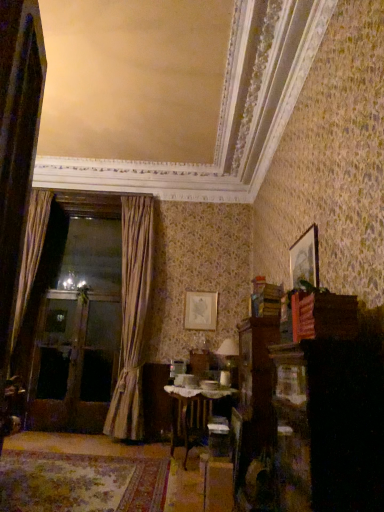
Question: Is wooden table at center wider than matte gold picture frame at center, marked as the second picture frame in a front-to-back arrangement?

Choices:
 (A) no
 (B) yes

Answer: (B)

Question: Considering the relative sizes of wooden table at center and matte gold picture frame at center, which ranks as the first picture frame in left-to-right order, in the image provided, is wooden table at center thinner than matte gold picture frame at center, which ranks as the first picture frame in left-to-right order,?

Choices:
 (A) no
 (B) yes

Answer: (A)

Question: Is wooden table at center turned away from matte gold picture frame at center, which is counted as the first picture frame, starting from the bottom?

Choices:
 (A) yes
 (B) no

Answer: (B)

Question: Is wooden table at center aimed at matte gold picture frame at center, which ranks as the first picture frame in left-to-right order?

Choices:
 (A) yes
 (B) no

Answer: (B)

Question: Would you say wooden table at center is outside matte gold picture frame at center, the 2th picture frame from the top?

Choices:
 (A) yes
 (B) no

Answer: (A)

Question: From the image's perspective, is silky beige curtain at left, marked as the 1th curtain in a left-to-right arrangement, positioned above or below gold textured curtain at left, the first curtain positioned from the right?

Choices:
 (A) below
 (B) above

Answer: (B)

Question: From a real-world perspective, relative to gold textured curtain at left, placed as the 2th curtain when sorted from left to right, is silky beige curtain at left, marked as the 1th curtain in a left-to-right arrangement, vertically above or below?

Choices:
 (A) below
 (B) above

Answer: (B)

Question: Considering the positions of point (39, 228) and point (125, 254), is point (39, 228) closer or farther from the camera than point (125, 254)?

Choices:
 (A) closer
 (B) farther

Answer: (B)

Question: Considering the positions of silky beige curtain at left, the 2th curtain in the right-to-left sequence, and gold textured curtain at left, the first curtain positioned from the right, in the image, is silky beige curtain at left, the 2th curtain in the right-to-left sequence, bigger or smaller than gold textured curtain at left, the first curtain positioned from the right,?

Choices:
 (A) big
 (B) small

Answer: (B)

Question: In terms of height, does silky beige curtain at left, the 2th curtain in the right-to-left sequence, look taller or shorter compared to matte gold picture frame at center, the 2th picture frame from the top?

Choices:
 (A) tall
 (B) short

Answer: (A)

Question: Is silky beige curtain at left, marked as the 1th curtain in a left-to-right arrangement, wider or thinner than matte gold picture frame at center, which appears as the 1th picture frame when viewed from the back?

Choices:
 (A) thin
 (B) wide

Answer: (B)

Question: Is point (29, 202) closer or farther from the camera than point (203, 312)?

Choices:
 (A) closer
 (B) farther

Answer: (A)

Question: Looking at the image, does silky beige curtain at left, marked as the 1th curtain in a left-to-right arrangement, seem bigger or smaller compared to matte gold picture frame at center, which is counted as the first picture frame, starting from the bottom?

Choices:
 (A) big
 (B) small

Answer: (A)

Question: From a real-world perspective, relative to gold textured curtain at left, placed as the 2th curtain when sorted from left to right, is wooden table at center vertically above or below?

Choices:
 (A) below
 (B) above

Answer: (A)

Question: Considering their positions, is wooden table at center located in front of or behind gold textured curtain at left, placed as the 2th curtain when sorted from left to right?

Choices:
 (A) front
 (B) behind

Answer: (A)